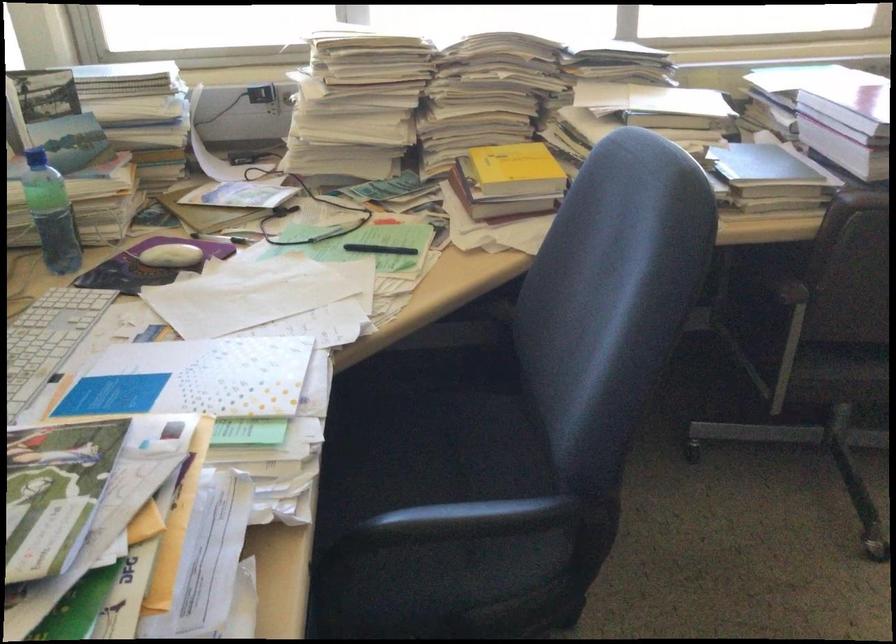
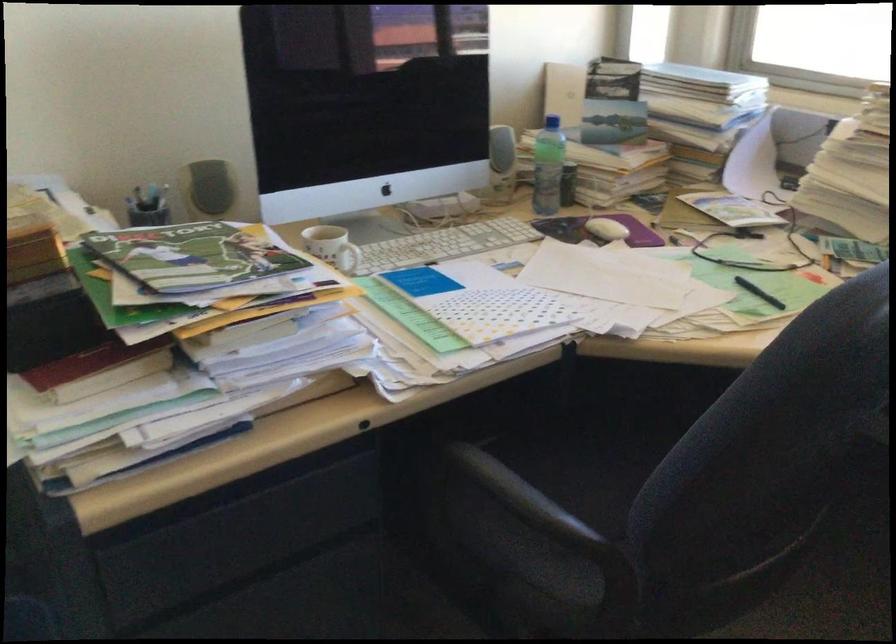
Find the pixel in the second image that matches pixel 528 509 in the first image.

(532, 506)